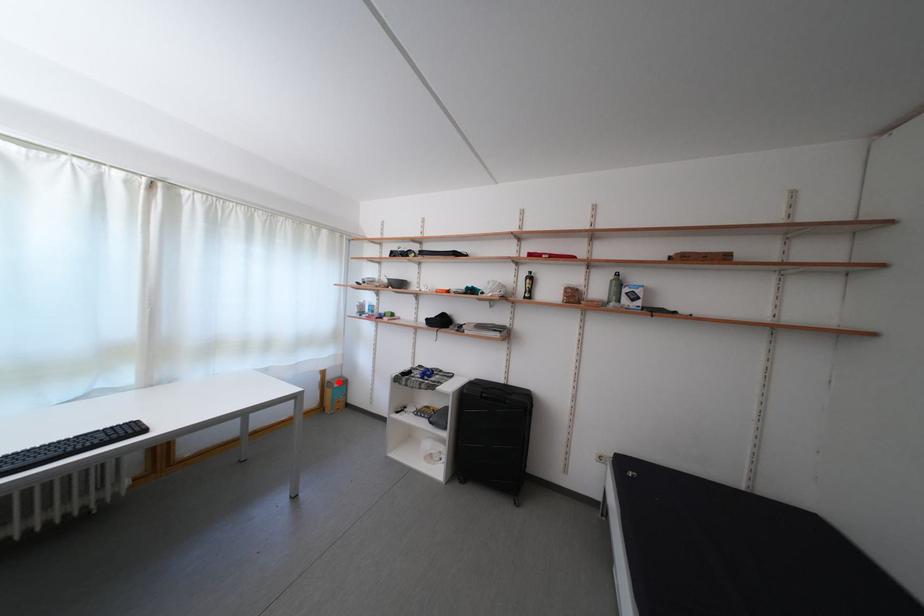
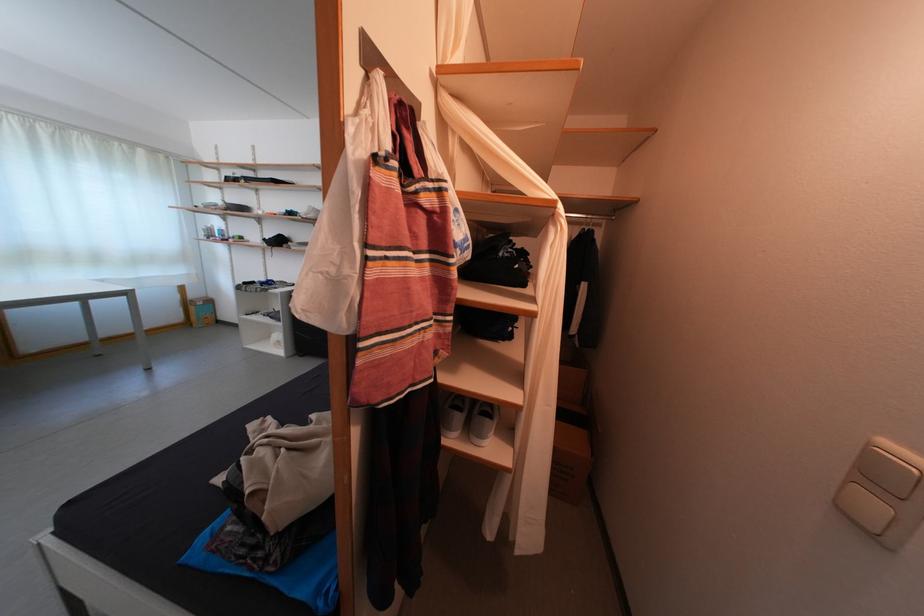
Question: I am providing you with two images of the same scene from different viewpoints. In image1, a red point is highlighted. Considering the same 3D point in image2, which of the following is correct?

Choices:
 (A) It is closer
 (B) It is farther

Answer: (A)